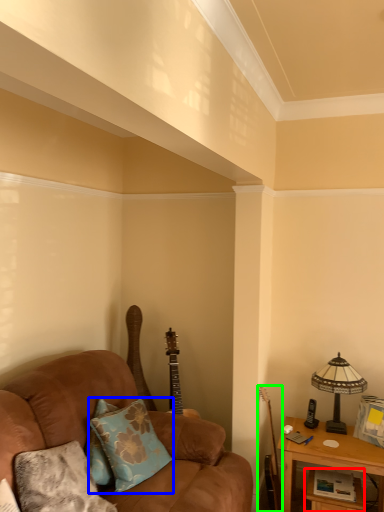
Question: Based on their relative distances, which object is nearer to table (highlighted by a red box)? Choose from pillow (highlighted by a blue box) and guitar (highlighted by a green box).

Choices:
 (A) pillow
 (B) guitar

Answer: (B)